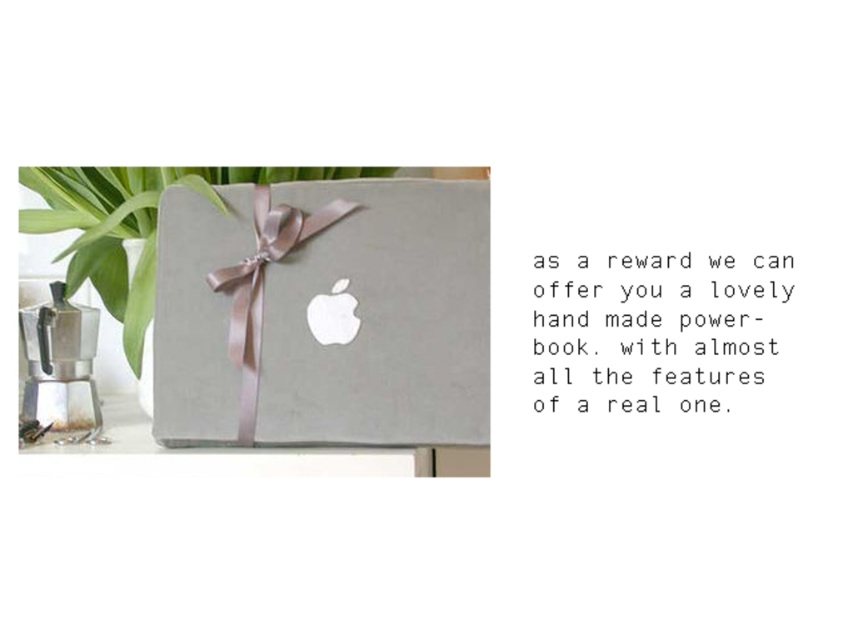
Is point (376, 211) behind point (250, 417)?

Yes, point (376, 211) is behind point (250, 417).

Looking at this image, does satin gray box at center appear over silky pink ribbon at center?

No, satin gray box at center is not above silky pink ribbon at center.

What do you see at coordinates (323, 314) in the screenshot?
I see `satin gray box at center` at bounding box center [323, 314].

Identify the location of satin gray box at center. The width and height of the screenshot is (853, 640). (323, 314).